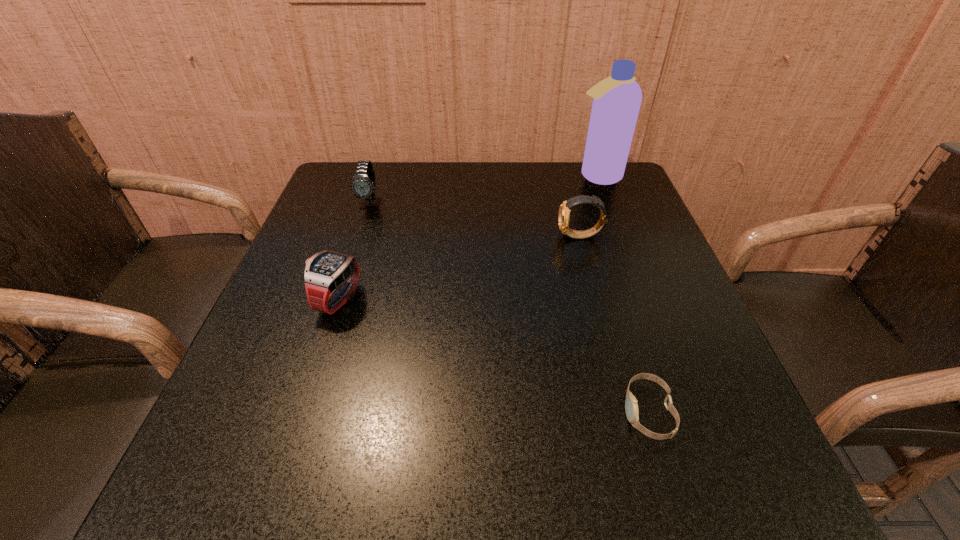
Locate which watch is the second closest to the third farthest watch. Please provide its 2D coordinates. Your answer should be formatted as a tuple, i.e. [(x, y)], where the tuple contains the x and y coordinates of a point satisfying the conditions above.

[(564, 211)]

Where is `watch that stands as the second closest to the shampoo`? The image size is (960, 540). watch that stands as the second closest to the shampoo is located at coordinates (363, 185).

Locate an element on the screen. This screenshot has width=960, height=540. vacant space that satisfies the following two spatial constraints: 1. on the front side of the tallest object; 2. on the face of the shortest watch is located at coordinates (685, 412).

In order to click on vacant area in the image that satisfies the following two spatial constraints: 1. on the back side of the third farthest watch; 2. on the left side of the farthest object in this screenshot , I will do [378, 176].

Locate an element on the screen. vacant space that satisfies the following two spatial constraints: 1. on the face of the third nearest watch; 2. on the front side of the second nearest object is located at coordinates (597, 300).